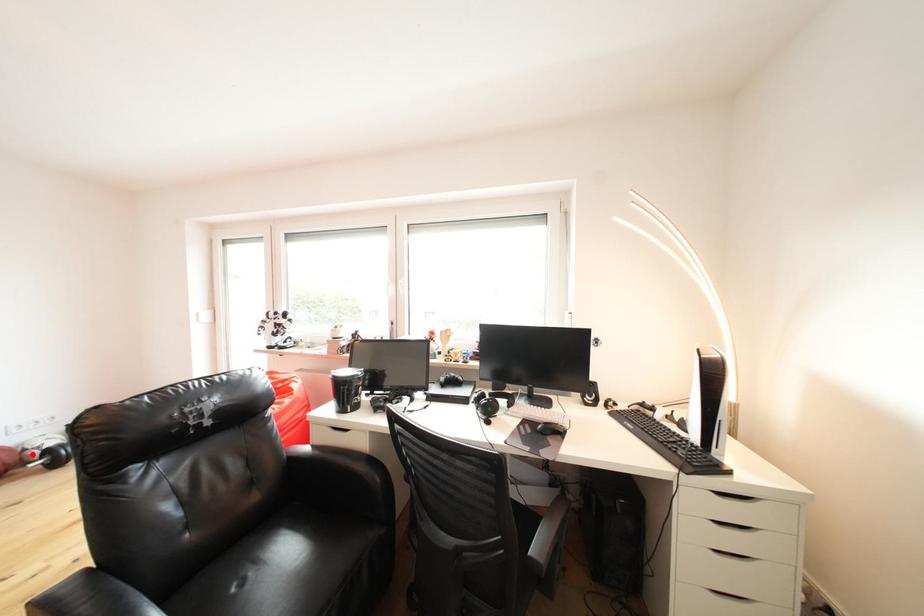
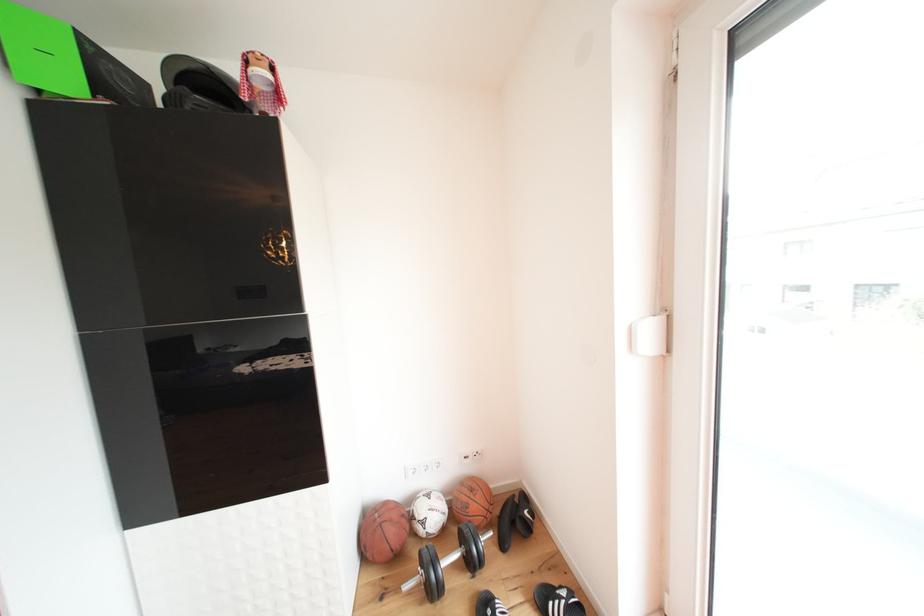
Where in the second image is the point corresponding to the highlighted location from the first image?

(420, 523)